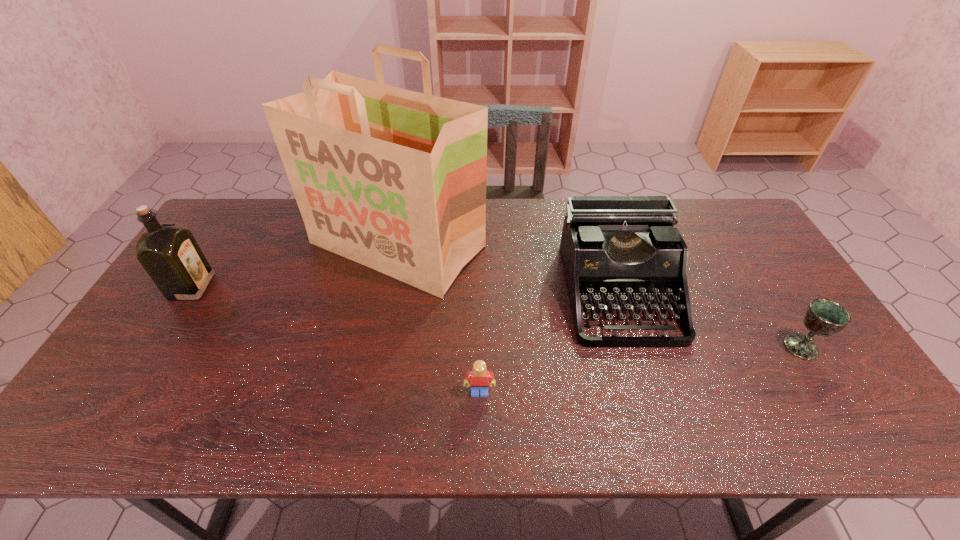
Identify the location of vacant region located on the label of the leftmost object. The width and height of the screenshot is (960, 540). (318, 287).

The width and height of the screenshot is (960, 540). In order to click on blank space located 0.120m on the typing side of the third tallest object in this screenshot , I will do `click(647, 389)`.

Identify the location of free point located 0.210m on the front of the rightmost object. [860, 442].

Identify the location of free location located on the front-facing side of the nearest object. (480, 417).

At what (x,y) coordinates should I click in order to perform the action: click on object positioned at the far edge. Please return your answer as a coordinate pair (x, y). Looking at the image, I should click on (393, 179).

The height and width of the screenshot is (540, 960). In order to click on object positioned at the left edge in this screenshot , I will do `click(169, 253)`.

At what (x,y) coordinates should I click in order to perform the action: click on object located in the right edge section of the desktop. Please return your answer as a coordinate pair (x, y). Looking at the image, I should click on (824, 317).

The height and width of the screenshot is (540, 960). Identify the location of vacant space at the far edge of the desktop. (520, 235).

Image resolution: width=960 pixels, height=540 pixels. In the image, there is a desktop. Identify the location of vacant space at the near edge. (300, 428).

The height and width of the screenshot is (540, 960). In the image, there is a desktop. Identify the location of vacant space at the left edge. click(213, 244).